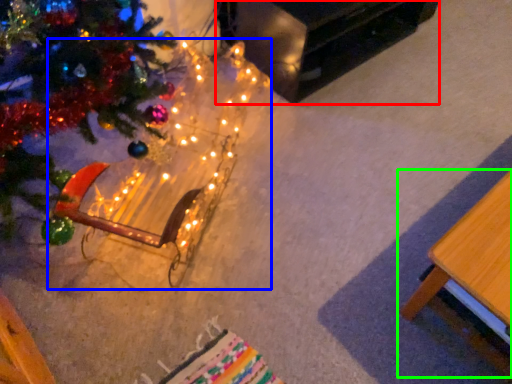
Question: Which is nearer to the table (highlighted by a red box)? christmas decoration (highlighted by a blue box) or table (highlighted by a green box).

Choices:
 (A) christmas decoration
 (B) table

Answer: (A)